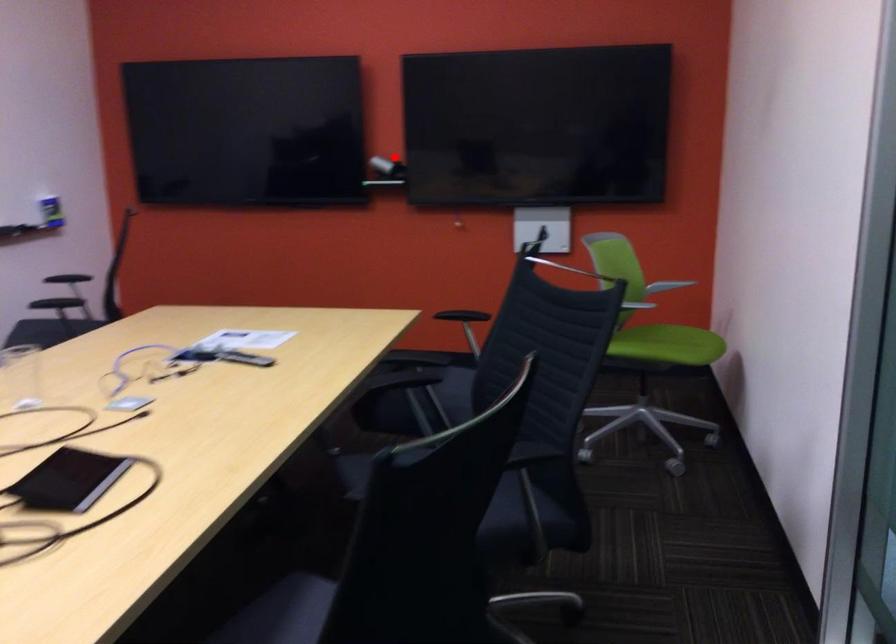
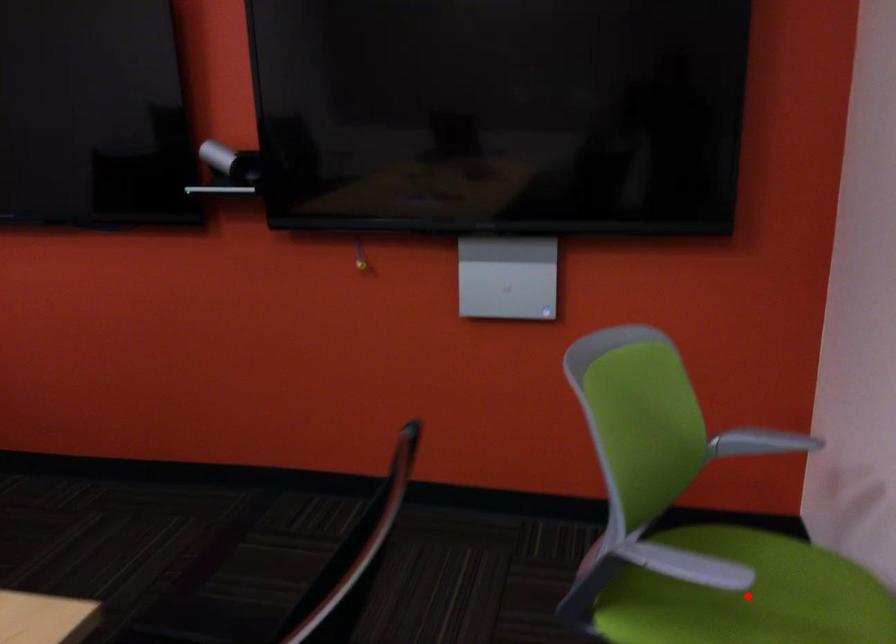
I am providing you with two images of the same scene from different viewpoints. A red point is marked on the first image and another point is marked on the second image. Is the marked point in image1 the same physical position as the marked point in image2?

No